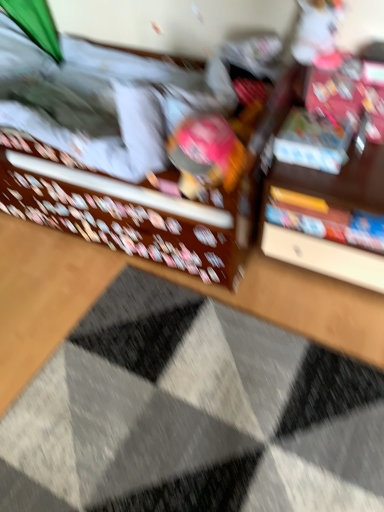
At what (x,y) coordinates should I click in order to perform the action: click on vacant point above textured gray doormat at center (from a real-world perspective). Please return your answer as a coordinate pair (x, y). The image size is (384, 512). Looking at the image, I should click on (193, 413).